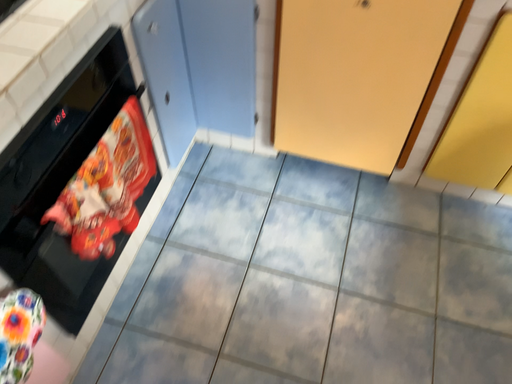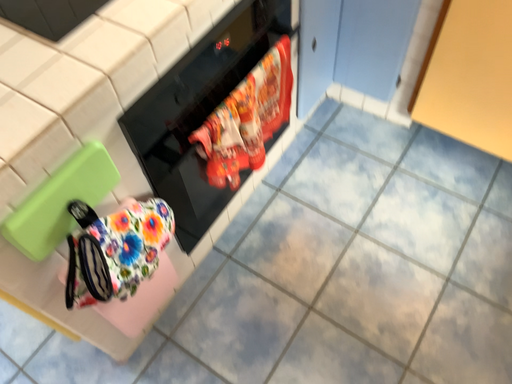
Question: Which way did the camera rotate in the video?

Choices:
 (A) rotated left
 (B) rotated right

Answer: (A)